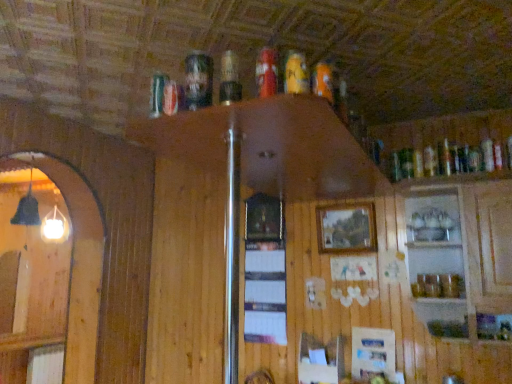
What are the coordinates of `orange matte can at upper center, the 1th beer from the right` in the screenshot? It's located at (324, 81).

Locate an element on the screen. The height and width of the screenshot is (384, 512). wooden picture frame at center is located at coordinates (346, 228).

At what (x,y) coordinates should I click in order to perform the action: click on clear glass cabinet at upper right. Please return your answer as a coordinate pair (x, y). The image size is (512, 384). Looking at the image, I should click on (461, 271).

Image resolution: width=512 pixels, height=384 pixels. I want to click on cabinetry in front of the wooden picture frame at center, so [461, 271].

Looking at this image, is wooden picture frame at center smaller than clear glass cabinet at upper right?

Indeed, wooden picture frame at center has a smaller size compared to clear glass cabinet at upper right.

Is wooden picture frame at center beside clear glass cabinet at upper right?

wooden picture frame at center is not next to clear glass cabinet at upper right, and they're not touching.

Based on the photo, is wooden picture frame at center positioned with its back to clear glass cabinet at upper right?

wooden picture frame at center is not turned away from clear glass cabinet at upper right.

Consider the image. Is clear glass cabinet at upper right far away from orange matte can at upper center, which appears as the fourth beer when viewed from the left?

clear glass cabinet at upper right is positioned a significant distance from orange matte can at upper center, which appears as the fourth beer when viewed from the left.

From a real-world perspective, is clear glass cabinet at upper right located higher than orange matte can at upper center, which appears as the fourth beer when viewed from the left?

Actually, clear glass cabinet at upper right is physically below orange matte can at upper center, which appears as the fourth beer when viewed from the left, in the real world.

Is clear glass cabinet at upper right taller or shorter than orange matte can at upper center, the 1th beer from the right?

Clearly, clear glass cabinet at upper right is taller compared to orange matte can at upper center, the 1th beer from the right.

Considering the sizes of objects matte plastic beer can at upper center, placed as the 2th beer when sorted from left to right, and wooden picture frame at center in the image provided, who is bigger, matte plastic beer can at upper center, placed as the 2th beer when sorted from left to right, or wooden picture frame at center?

wooden picture frame at center.

From their relative heights in the image, would you say matte plastic beer can at upper center, which ranks as the 3th beer in right-to-left order, is taller or shorter than wooden picture frame at center?

Considering their sizes, matte plastic beer can at upper center, which ranks as the 3th beer in right-to-left order, has less height than wooden picture frame at center.

Considering the positions of objects matte plastic beer can at upper center, which ranks as the 3th beer in right-to-left order, and wooden picture frame at center in the image provided, who is more to the left, matte plastic beer can at upper center, which ranks as the 3th beer in right-to-left order, or wooden picture frame at center?

matte plastic beer can at upper center, which ranks as the 3th beer in right-to-left order, is more to the left.

Considering the relative sizes of matte plastic beer can at upper center, placed as the 2th beer when sorted from left to right, and wooden picture frame at center in the image provided, is matte plastic beer can at upper center, placed as the 2th beer when sorted from left to right, thinner than wooden picture frame at center?

No, matte plastic beer can at upper center, placed as the 2th beer when sorted from left to right, is not thinner than wooden picture frame at center.

Does matte plastic beer can at upper center, which ranks as the 3th beer in right-to-left order, have a greater width compared to clear glass cabinet at upper right?

No.

Who is shorter, matte plastic beer can at upper center, placed as the 2th beer when sorted from left to right, or clear glass cabinet at upper right?

matte plastic beer can at upper center, placed as the 2th beer when sorted from left to right, is shorter.

Which point is more forward, (195, 84) or (441, 270)?

The point (195, 84) is closer.

Looking at this image, looking at the image, does matte plastic beer can at upper center, placed as the 2th beer when sorted from left to right, seem bigger or smaller compared to clear glass cabinet at upper right?

matte plastic beer can at upper center, placed as the 2th beer when sorted from left to right, is smaller than clear glass cabinet at upper right.

Is clear glass cabinet at upper right positioned in front of matte plastic beer can at upper center, which ranks as the 3th beer in right-to-left order?

No, clear glass cabinet at upper right is behind matte plastic beer can at upper center, which ranks as the 3th beer in right-to-left order.

Is matte plastic beer can at upper center, placed as the 2th beer when sorted from left to right, located within clear glass cabinet at upper right?

No, matte plastic beer can at upper center, placed as the 2th beer when sorted from left to right, is not a part of clear glass cabinet at upper right.

Is clear glass cabinet at upper right facing towards matte plastic beer can at upper center, which ranks as the 3th beer in right-to-left order?

Yes, clear glass cabinet at upper right is oriented towards matte plastic beer can at upper center, which ranks as the 3th beer in right-to-left order.

There is a clear glass cabinet at upper right. Identify the location of the 4th beer above it (from a real-world perspective). (198, 80).

From the image's perspective, between matte plastic beer at upper center, which is the second beer in right-to-left order, and clear glass cabinet at upper right, who is located below?

From the image's view, clear glass cabinet at upper right is below.

Is clear glass cabinet at upper right at the back of matte plastic beer at upper center, which is the second beer in right-to-left order?

Absolutely, matte plastic beer at upper center, which is the second beer in right-to-left order, is directed away from clear glass cabinet at upper right.

Consider the image. Between matte plastic beer at upper center, which is the second beer in right-to-left order, and clear glass cabinet at upper right, which one has less height?

With less height is matte plastic beer at upper center, which is the second beer in right-to-left order.

Which object is positioned more to the right, matte plastic beer at upper center, arranged as the 3th beer when viewed from the left, or clear glass cabinet at upper right?

clear glass cabinet at upper right is more to the right.

At what (x,y) coordinates should I click in order to perform the action: click on beer that is the 4th object to the left of the wooden picture frame at center, starting at the anchor. Please return your answer as a coordinate pair (x, y). Looking at the image, I should click on (170, 98).

Could you tell me if shiny silver can at upper center, which is counted as the 1th beer, starting from the left, is turned towards wooden picture frame at center?

No, shiny silver can at upper center, which is counted as the 1th beer, starting from the left, does not turn towards wooden picture frame at center.

Consider the image. Is shiny silver can at upper center, which is counted as the 1th beer, starting from the left, in front of wooden picture frame at center?

Yes.

Find the location of a particular element. cabinetry directly beneath the wooden picture frame at center (from a real-world perspective) is located at coordinates (461, 271).

Where is `cabinetry behind the orange matte can at upper center, which appears as the fourth beer when viewed from the left`? The height and width of the screenshot is (384, 512). cabinetry behind the orange matte can at upper center, which appears as the fourth beer when viewed from the left is located at coordinates (461, 271).

Considering their positions, is matte plastic beer at upper center, arranged as the 3th beer when viewed from the left, positioned closer to matte plastic beer can at upper center, which ranks as the 3th beer in right-to-left order, than clear glass cabinet at upper right?

Among the two, matte plastic beer at upper center, arranged as the 3th beer when viewed from the left, is located nearer to matte plastic beer can at upper center, which ranks as the 3th beer in right-to-left order.

When comparing their distances from clear glass cabinet at upper right, does matte plastic beer at upper center, which is the second beer in right-to-left order, or wooden picture frame at center seem closer?

Among the two, wooden picture frame at center is located nearer to clear glass cabinet at upper right.

Estimate the real-world distances between objects in this image. Which object is closer to orange matte can at upper center, the 1th beer from the right, wooden picture frame at center or matte plastic beer can at upper center, placed as the 2th beer when sorted from left to right?

matte plastic beer can at upper center, placed as the 2th beer when sorted from left to right.

From the image, which object appears to be nearer to clear glass cabinet at upper right, matte plastic beer can at upper center, placed as the 2th beer when sorted from left to right, or wooden picture frame at center?

wooden picture frame at center lies closer to clear glass cabinet at upper right than the other object.

Looking at the image, which one is located closer to orange matte can at upper center, the 1th beer from the right, clear glass cabinet at upper right or wooden picture frame at center?

clear glass cabinet at upper right is closer to orange matte can at upper center, the 1th beer from the right.

From the image, which object appears to be farther from orange matte can at upper center, which appears as the fourth beer when viewed from the left, shiny silver can at upper center, the 4th beer when ordered from right to left, or wooden picture frame at center?

wooden picture frame at center lies further to orange matte can at upper center, which appears as the fourth beer when viewed from the left, than the other object.

Considering their positions, is clear glass cabinet at upper right positioned closer to shiny silver can at upper center, which is counted as the 1th beer, starting from the left, than orange matte can at upper center, the 1th beer from the right?

The object closer to shiny silver can at upper center, which is counted as the 1th beer, starting from the left, is orange matte can at upper center, the 1th beer from the right.

In the scene shown: Which object lies further to the anchor point clear glass cabinet at upper right, wooden picture frame at center or matte plastic beer at upper center, arranged as the 3th beer when viewed from the left?

matte plastic beer at upper center, arranged as the 3th beer when viewed from the left.

Image resolution: width=512 pixels, height=384 pixels. What are the coordinates of `beer between shiny silver can at upper center, which is counted as the 1th beer, starting from the left, and matte plastic beer at upper center, which is the second beer in right-to-left order` in the screenshot? It's located at (198, 80).

Where is `beer situated between matte plastic beer can at upper center, which ranks as the 3th beer in right-to-left order, and orange matte can at upper center, the 1th beer from the right, from left to right`? beer situated between matte plastic beer can at upper center, which ranks as the 3th beer in right-to-left order, and orange matte can at upper center, the 1th beer from the right, from left to right is located at coordinates (296, 73).

The width and height of the screenshot is (512, 384). Identify the location of cabinetry between matte plastic beer at upper center, which is the second beer in right-to-left order, and wooden picture frame at center in the front-back direction. (461, 271).

I want to click on cabinetry located between orange matte can at upper center, the 1th beer from the right, and wooden picture frame at center in the depth direction, so click(x=461, y=271).